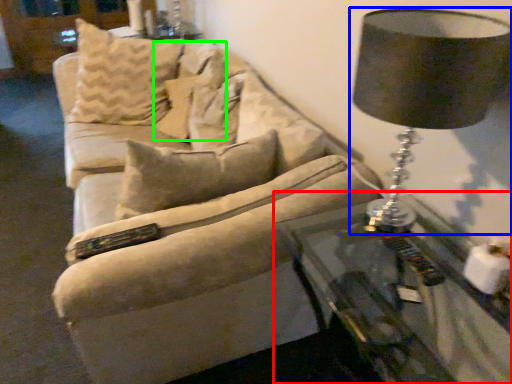
Question: Which object is positioned farthest from table (highlighted by a red box)? Select from lamp (highlighted by a blue box) and pillow (highlighted by a green box).

Choices:
 (A) lamp
 (B) pillow

Answer: (B)